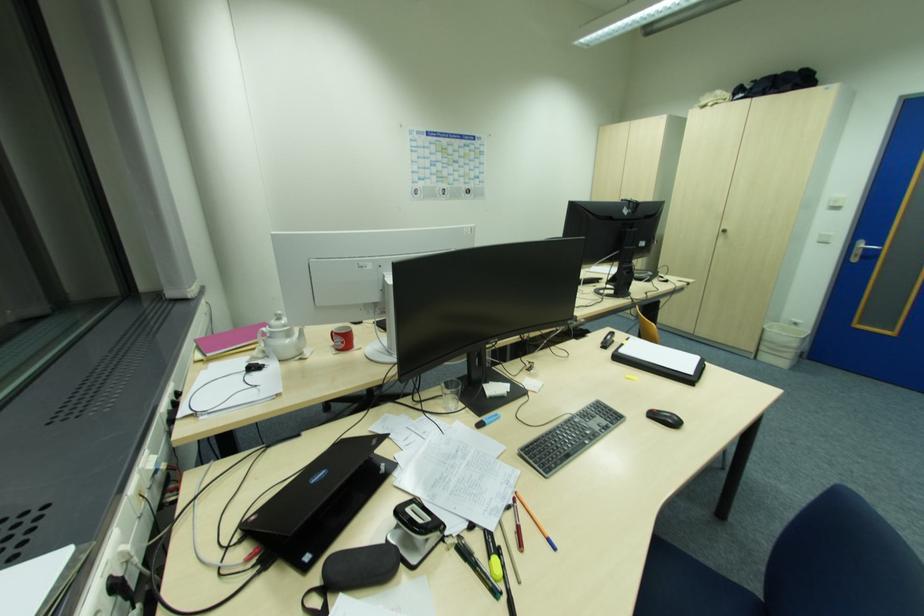
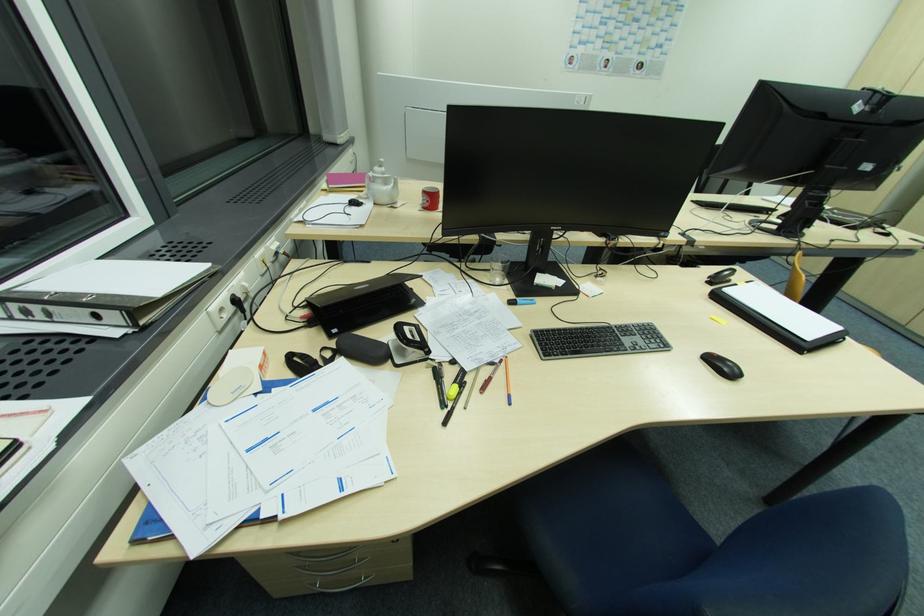
In the second image, find the point that corresponds to point 281,362 in the first image.

(377, 205)